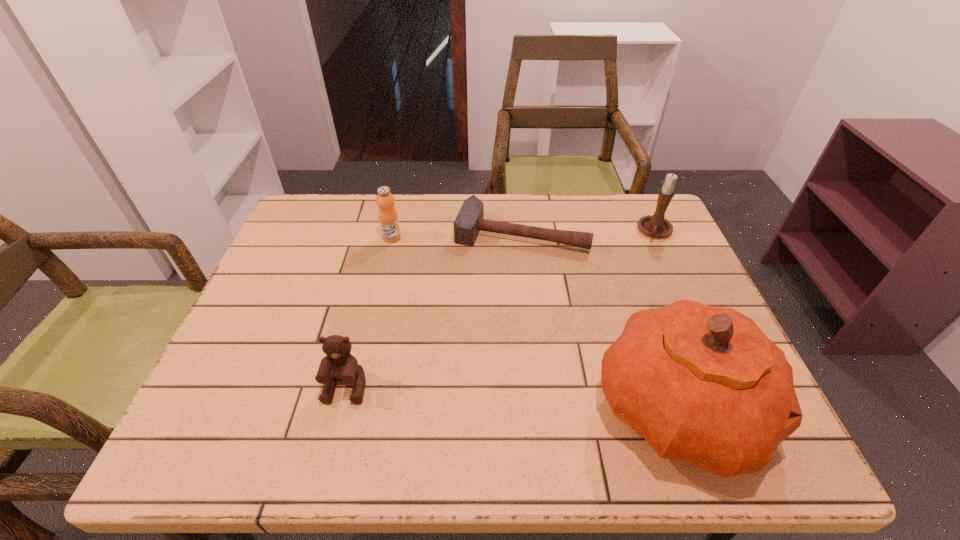
Where is `free location that satisfies the following two spatial constraints: 1. on the face of the pumpkin; 2. on the front-facing side of the teddy bear`? This screenshot has width=960, height=540. free location that satisfies the following two spatial constraints: 1. on the face of the pumpkin; 2. on the front-facing side of the teddy bear is located at coordinates (341, 408).

You are a GUI agent. You are given a task and a screenshot of the screen. Output one action in this format:
    pyautogui.click(x=<x>, y=<y>)
    Task: Click on the vacant position in the image that satisfies the following two spatial constraints: 1. on the face of the fourth tallest object; 2. on the front-facing side of the pumpkin
    The height and width of the screenshot is (540, 960).
    Given the screenshot: What is the action you would take?
    click(x=341, y=408)